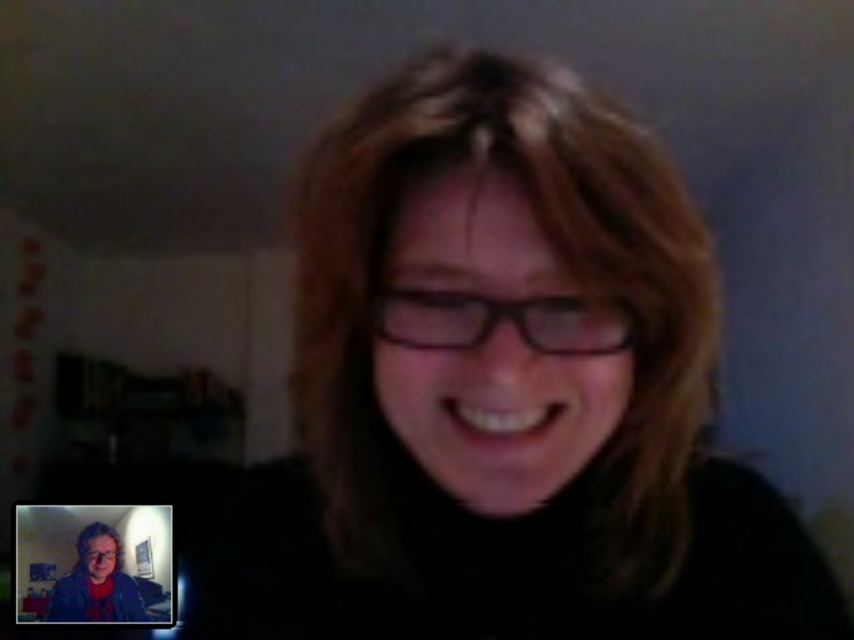
Question: Is matte black glasses at center thinner than matte black hair at center?

Choices:
 (A) no
 (B) yes

Answer: (B)

Question: Considering the relative positions of matte black glasses at center and matte black hair at center in the image provided, where is matte black glasses at center located with respect to matte black hair at center?

Choices:
 (A) above
 (B) below

Answer: (A)

Question: Which point is farther to the camera?

Choices:
 (A) (79, 557)
 (B) (629, 170)

Answer: (A)

Question: Which point is farther from the camera taking this photo?

Choices:
 (A) pos(86,566)
 (B) pos(364,536)

Answer: (A)

Question: Considering the relative positions of matte black glasses at center and matte black hair at center in the image provided, where is matte black glasses at center located with respect to matte black hair at center?

Choices:
 (A) above
 (B) below

Answer: (A)